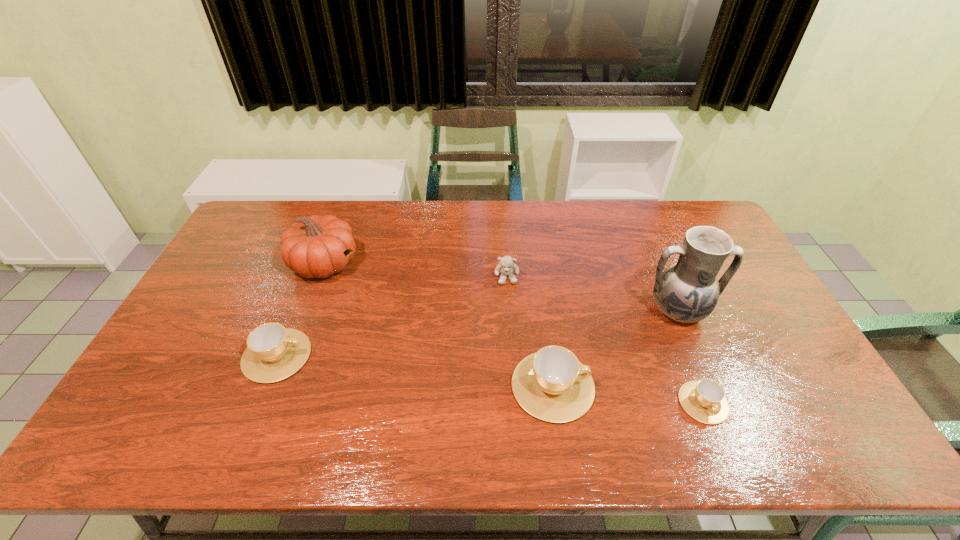
The height and width of the screenshot is (540, 960). In order to click on vacant space that is in between the second cup from left to right and the rightmost cup in this screenshot , I will do `click(628, 394)`.

Find the location of a particular element. free point between the pitcher and the fifth shortest object is located at coordinates (501, 287).

Locate an element on the screen. The width and height of the screenshot is (960, 540). blank region between the second cup from left to right and the second shortest cup is located at coordinates (415, 371).

Locate an element on the screen. This screenshot has width=960, height=540. vacant space that is in between the shortest cup and the pumpkin is located at coordinates (514, 333).

Locate an element on the screen. unoccupied position between the leftmost cup and the teddy bear is located at coordinates (392, 316).

You are a GUI agent. You are given a task and a screenshot of the screen. Output one action in this format:
    pyautogui.click(x=<x>, y=<y>)
    Task: Click on the empty space that is in between the second shortest cup and the pitcher
    
    Given the screenshot: What is the action you would take?
    pyautogui.click(x=477, y=334)

Identify the location of the fourth closest object to the pumpkin. The image size is (960, 540). (687, 291).

Point out which object is positioned as the third nearest to the rightmost cup. Please provide its 2D coordinates. Your answer should be formatted as a tuple, i.e. [(x, y)], where the tuple contains the x and y coordinates of a point satisfying the conditions above.

[(506, 267)]

Identify which cup is the nearest to the pumpkin. Please provide its 2D coordinates. Your answer should be formatted as a tuple, i.e. [(x, y)], where the tuple contains the x and y coordinates of a point satisfying the conditions above.

[(274, 352)]

Locate an element on the screen. This screenshot has width=960, height=540. cup object that ranks as the second closest to the tallest object is located at coordinates (552, 385).